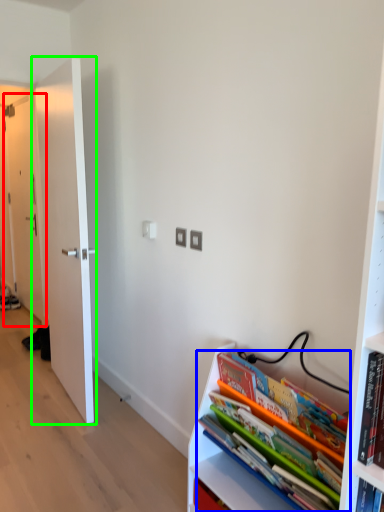
Question: Which is farther away from door (highlighted by a red box)? book (highlighted by a blue box) or door (highlighted by a green box)?

Choices:
 (A) book
 (B) door

Answer: (A)